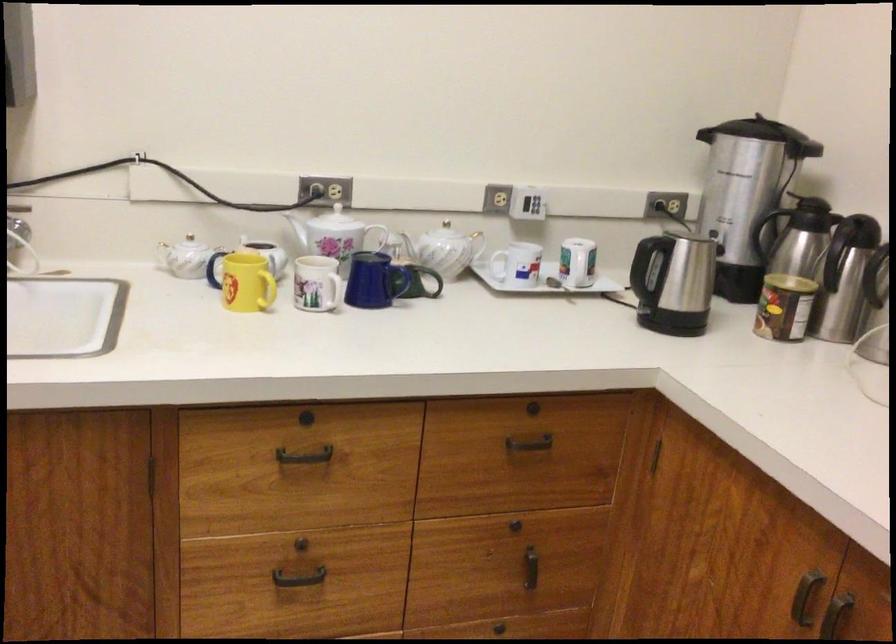
I want to click on brown tin can, so click(x=784, y=307).